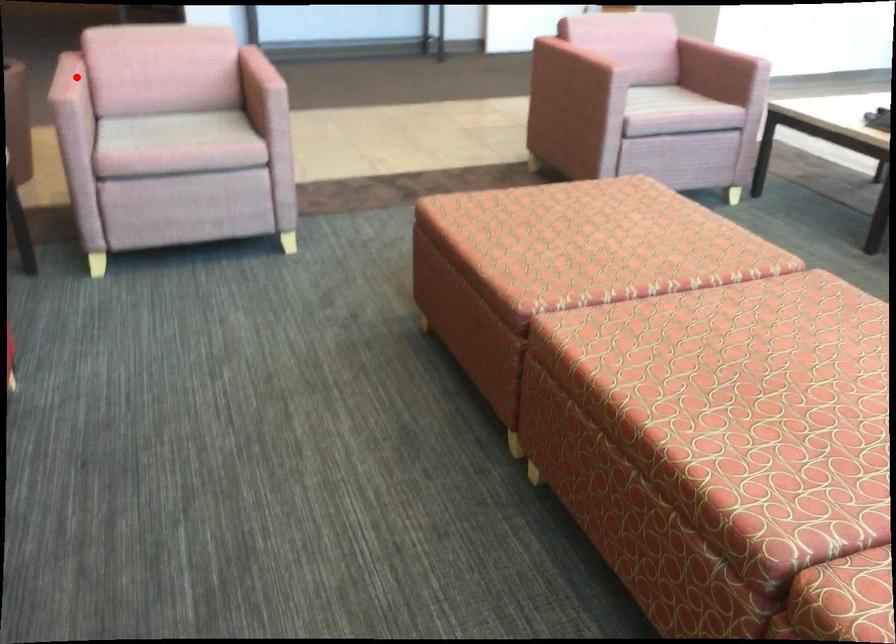
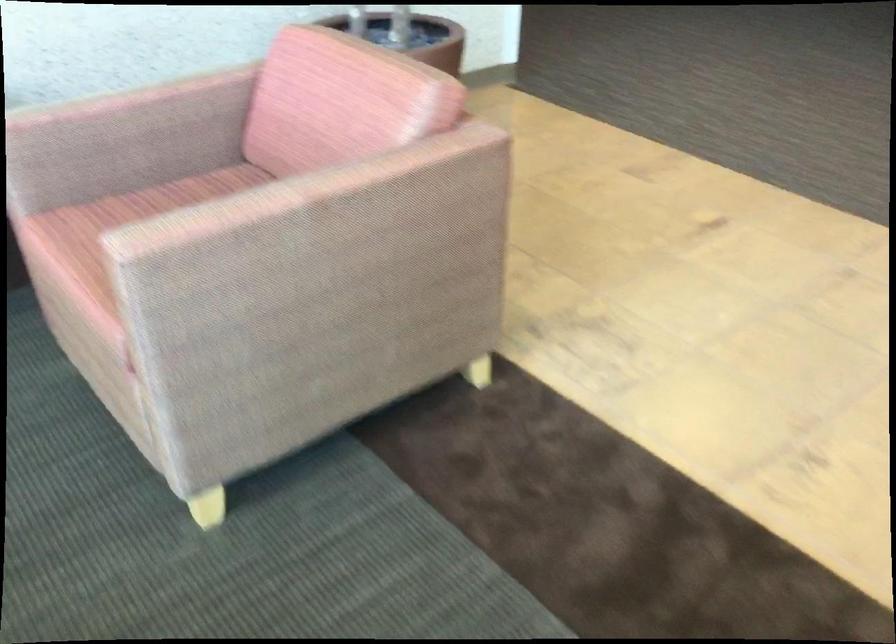
Question: A red point is marked in image1. In image2, is the corresponding 3D point closer to the camera or farther? Reply with the corresponding letter.

Choices:
 (A) The corresponding 3D point is closer.
 (B) The corresponding 3D point is farther.

Answer: (A)